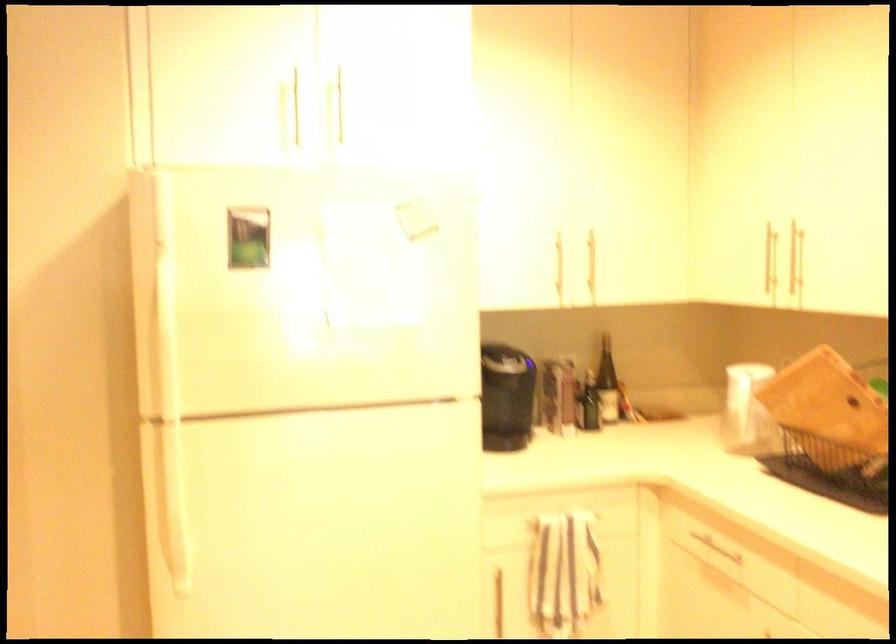
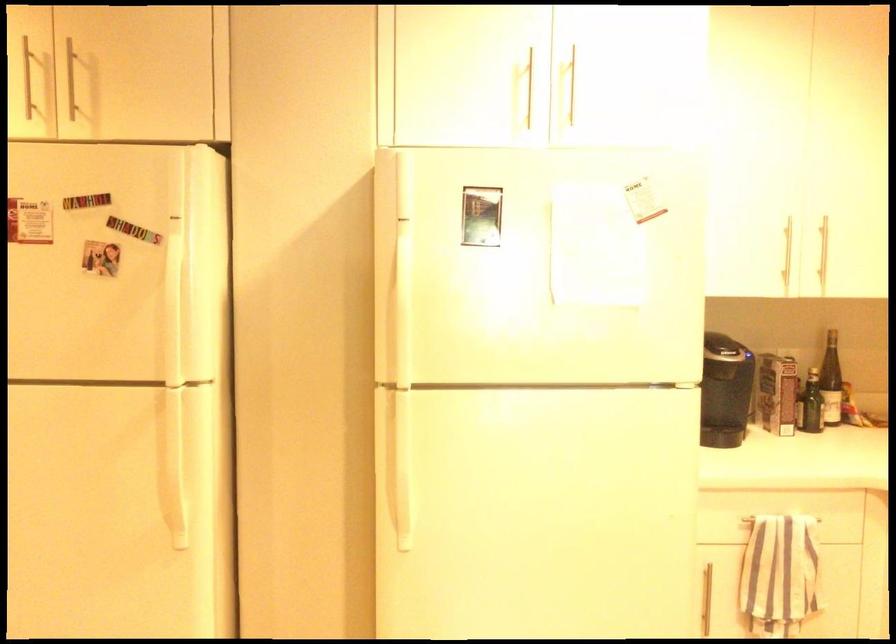
Find the pixel in the second image that matches pixel 558 397 in the first image.

(777, 393)